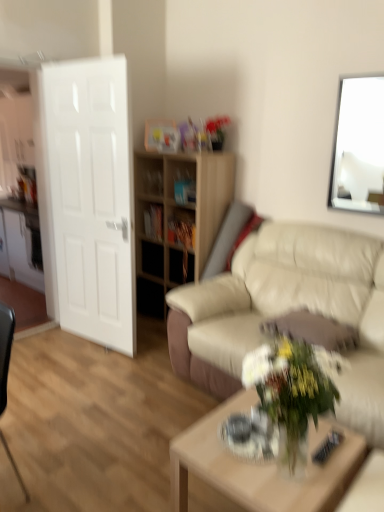
Question: From the image's perspective, is black matte drawer at center above white glossy door at left?

Choices:
 (A) yes
 (B) no

Answer: (B)

Question: From the image's perspective, is black matte drawer at center located beneath white glossy door at left?

Choices:
 (A) yes
 (B) no

Answer: (A)

Question: Would you consider black matte drawer at center to be distant from white glossy door at left?

Choices:
 (A) yes
 (B) no

Answer: (A)

Question: Is white glossy door at left at the back of black matte drawer at center?

Choices:
 (A) no
 (B) yes

Answer: (A)

Question: Is black matte drawer at center oriented towards white glossy door at left?

Choices:
 (A) no
 (B) yes

Answer: (A)

Question: Is black matte drawer at center at the left side of white glossy door at left?

Choices:
 (A) no
 (B) yes

Answer: (A)

Question: Would you say light wood shelf at center is outside white glossy picture frame at upper right?

Choices:
 (A) yes
 (B) no

Answer: (A)

Question: Could you tell me if light wood shelf at center is facing white glossy picture frame at upper right?

Choices:
 (A) no
 (B) yes

Answer: (A)

Question: From a real-world perspective, is light wood shelf at center on white glossy picture frame at upper right?

Choices:
 (A) no
 (B) yes

Answer: (A)

Question: From the image's perspective, is light wood shelf at center under white glossy picture frame at upper right?

Choices:
 (A) no
 (B) yes

Answer: (B)

Question: Considering the relative sizes of light wood shelf at center and white glossy picture frame at upper right in the image provided, is light wood shelf at center wider than white glossy picture frame at upper right?

Choices:
 (A) no
 (B) yes

Answer: (B)

Question: From the image's perspective, would you say light wood shelf at center is positioned over white glossy picture frame at upper right?

Choices:
 (A) yes
 (B) no

Answer: (B)

Question: Can you confirm if beige leather couch at center is shorter than white glossy door at left?

Choices:
 (A) no
 (B) yes

Answer: (B)